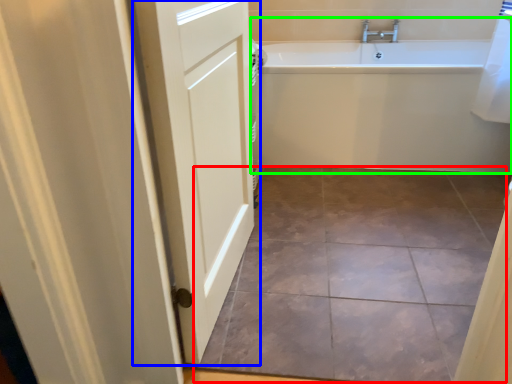
Question: Which is nearer to the ceramic tile (highlighted by a red box)? door (highlighted by a blue box) or bathtub (highlighted by a green box).

Choices:
 (A) door
 (B) bathtub

Answer: (A)